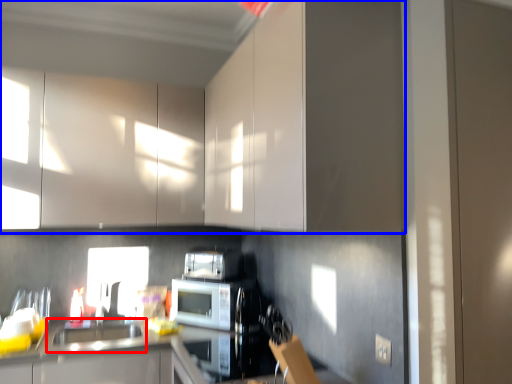
Question: Which object is closer to the camera taking this photo, sink (highlighted by a red box) or cabinetry (highlighted by a blue box)?

Choices:
 (A) sink
 (B) cabinetry

Answer: (B)